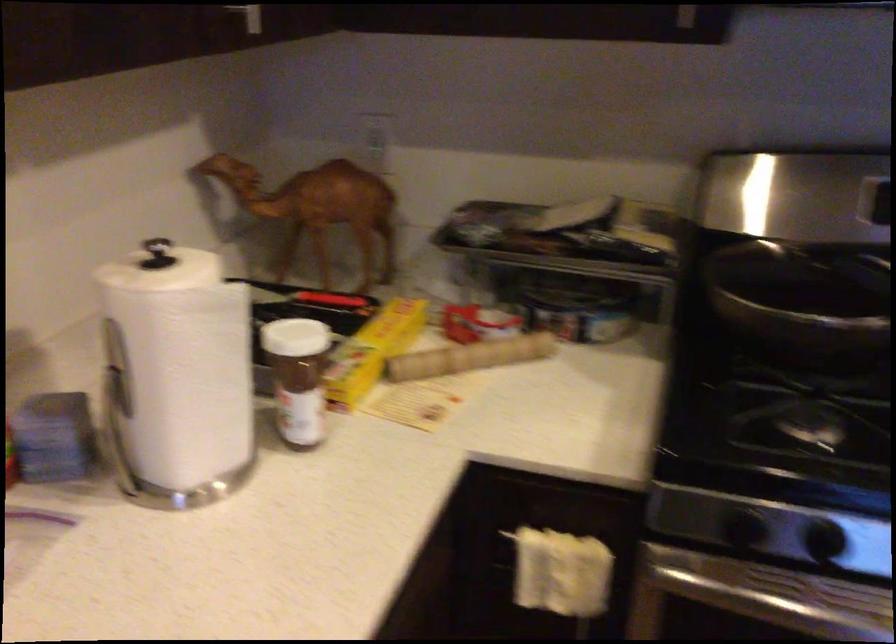
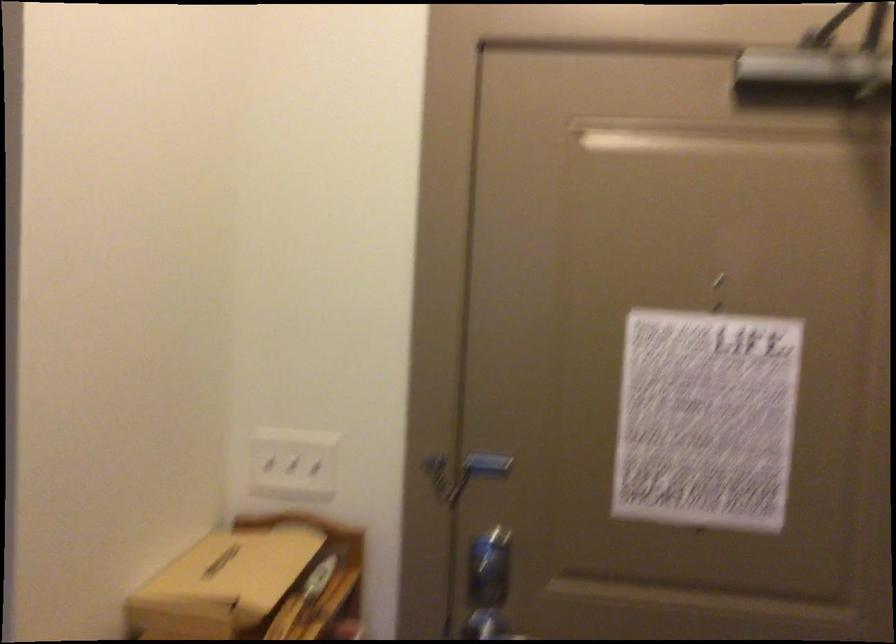
Question: What movement of the cameraman would produce the second image?

Choices:
 (A) Left
 (B) Right
 (C) Forward
 (D) Backward

Answer: (B)